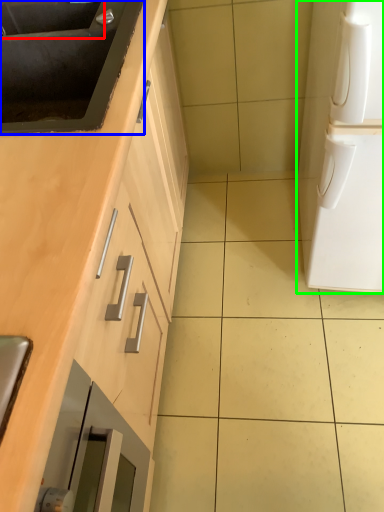
Question: Considering the real-world distances, which object is closest to sink (highlighted by a red box)? sink (highlighted by a blue box) or home appliance (highlighted by a green box).

Choices:
 (A) sink
 (B) home appliance

Answer: (A)